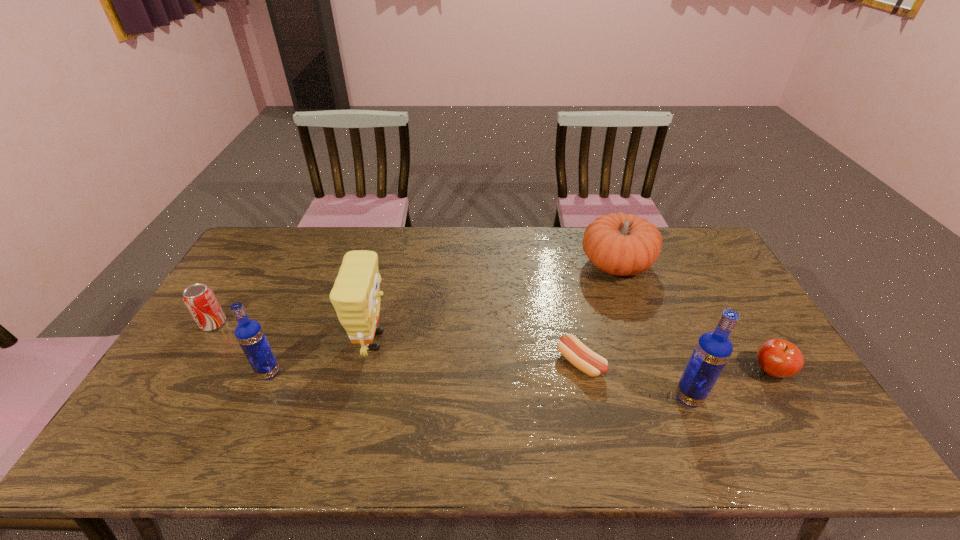
Locate an element on the screen. vacant space that's between the apple and the sixth object from right to left is located at coordinates (519, 372).

Where is `free point between the shorter vodka and the fourth object from left to right`? free point between the shorter vodka and the fourth object from left to right is located at coordinates (424, 368).

You are a GUI agent. You are given a task and a screenshot of the screen. Output one action in this format:
    pyautogui.click(x=<x>, y=<y>)
    Task: Click on the free spot between the leftmost object and the sponge
    
    Given the screenshot: What is the action you would take?
    pyautogui.click(x=294, y=332)

This screenshot has width=960, height=540. What are the coordinates of `blank region between the fourth object from left to right and the sixth tallest object` in the screenshot? It's located at (676, 367).

Find the location of a particular element. empty space between the farthest object and the nearer vodka is located at coordinates (653, 331).

The width and height of the screenshot is (960, 540). In order to click on vacant area that lies between the farthest object and the sausage in this screenshot , I will do `click(598, 314)`.

Identify the location of free space that is in between the soda can and the left vodka. (241, 348).

You are a GUI agent. You are given a task and a screenshot of the screen. Output one action in this format:
    pyautogui.click(x=<x>, y=<y>)
    Task: Click on the free space between the right vodka and the shorter vodka
    
    Given the screenshot: What is the action you would take?
    pyautogui.click(x=479, y=385)

Identify the location of empty space between the farther vodka and the sixth tallest object. The height and width of the screenshot is (540, 960). (519, 372).

You are a GUI agent. You are given a task and a screenshot of the screen. Output one action in this format:
    pyautogui.click(x=<x>, y=<y>)
    Task: Click on the vacant region between the second shortest object and the right vodka
    The width and height of the screenshot is (960, 540).
    Given the screenshot: What is the action you would take?
    [730, 384]